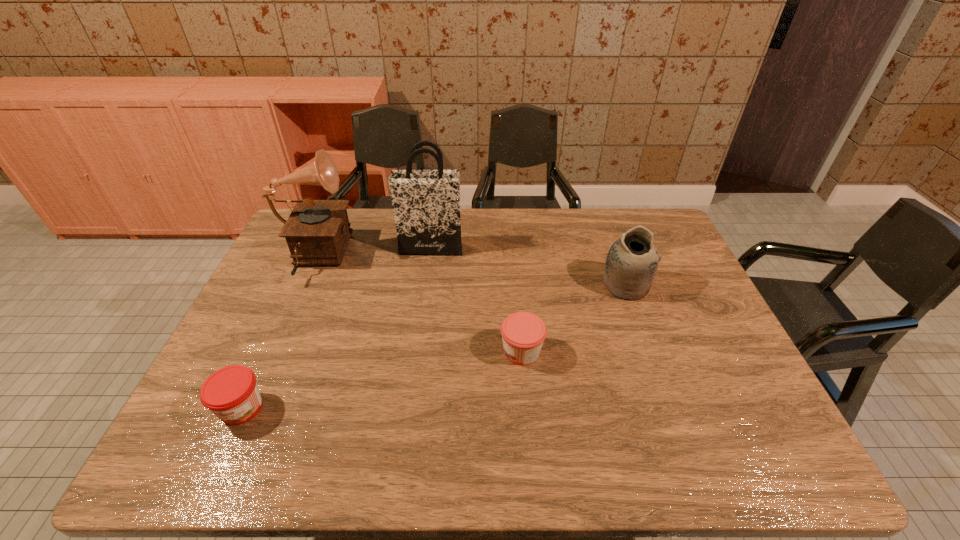
This screenshot has width=960, height=540. In order to click on vacant space located on the front of the pottery in this screenshot , I will do `click(637, 316)`.

Locate an element on the screen. vacant region located on the front label of the right jam is located at coordinates (423, 352).

The height and width of the screenshot is (540, 960). In order to click on free space located on the front label of the right jam in this screenshot , I will do `click(354, 352)`.

You are a GUI agent. You are given a task and a screenshot of the screen. Output one action in this format:
    pyautogui.click(x=<x>, y=<y>)
    Task: Click on the vacant space located 0.150m on the front label of the right jam
    This screenshot has height=540, width=960.
    Given the screenshot: What is the action you would take?
    pyautogui.click(x=443, y=352)

Identify the location of vacant position located 0.050m on the label side of the nearer jam. This screenshot has width=960, height=540. (222, 452).

You are a GUI agent. You are given a task and a screenshot of the screen. Output one action in this format:
    pyautogui.click(x=<x>, y=<y>)
    Task: Click on the shopping bag at the far edge
    Image resolution: width=960 pixels, height=540 pixels.
    Given the screenshot: What is the action you would take?
    pyautogui.click(x=426, y=203)

Find the location of a particular element. The width and height of the screenshot is (960, 540). record player located in the far edge section of the desktop is located at coordinates (317, 232).

This screenshot has height=540, width=960. Find the location of `record player located at the left edge`. record player located at the left edge is located at coordinates (317, 232).

The height and width of the screenshot is (540, 960). Find the location of `jam situated at the left edge`. jam situated at the left edge is located at coordinates [x=231, y=393].

Locate an element on the screen. object situated at the right edge is located at coordinates (632, 261).